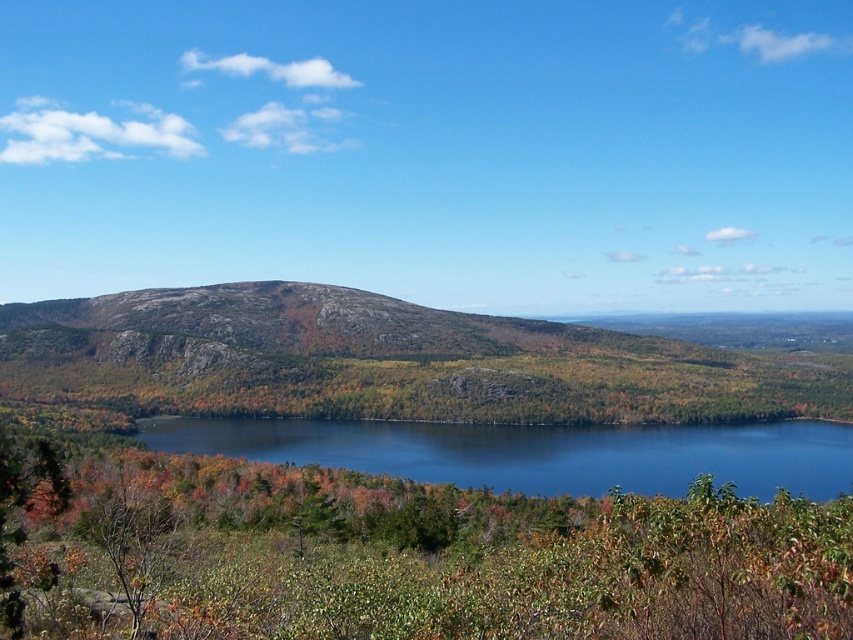
Question: Is rocky terrain at center below blue liquid water at center?

Choices:
 (A) yes
 (B) no

Answer: (B)

Question: Is rocky terrain at center to the left of blue liquid water at center from the viewer's perspective?

Choices:
 (A) yes
 (B) no

Answer: (A)

Question: Which of the following is the closest to the observer?

Choices:
 (A) (577, 493)
 (B) (368, 337)

Answer: (A)

Question: Does rocky terrain at center have a larger size compared to blue liquid water at center?

Choices:
 (A) yes
 (B) no

Answer: (A)

Question: Which point is farther from the camera taking this photo?

Choices:
 (A) (511, 460)
 (B) (523, 355)

Answer: (B)